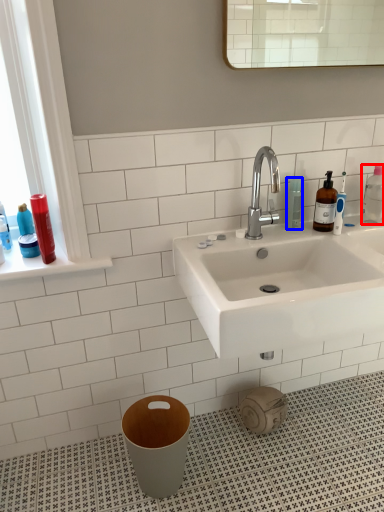
Question: Which object is closer to the camera taking this photo, cleaning product (highlighted by a red box) or mouthwash (highlighted by a blue box)?

Choices:
 (A) cleaning product
 (B) mouthwash

Answer: (B)